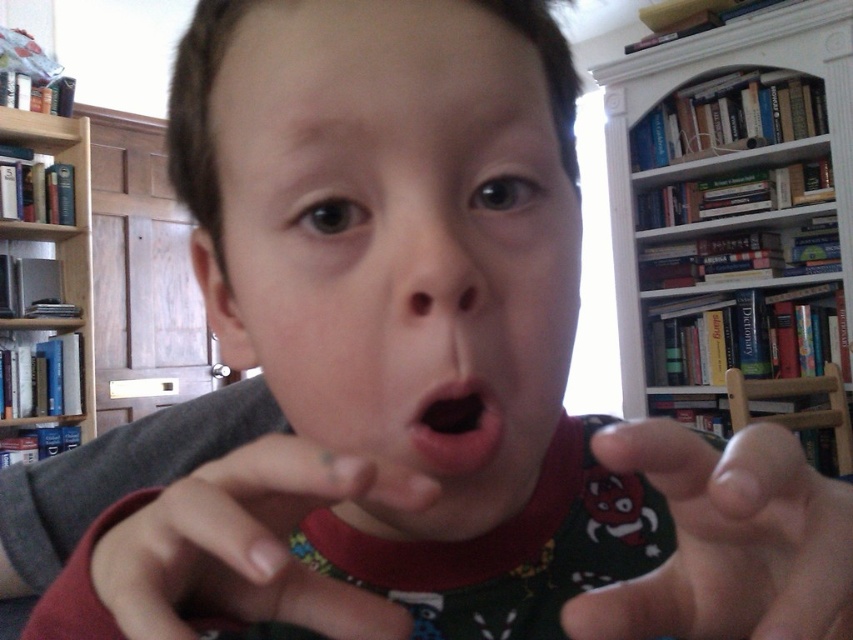
You are standing in a room with a wooden bookshelf and a child. You notice two points marked on the wall. The first point is at coordinates point (12, 458) and the second is at point (465, 378). Which point is closer to you?

Point (12, 458) is further to the viewer than point (465, 378), so the second point is closer to you.

You are a delivery person who needs to place a large package that is 6 feet long on the floor in front of the white wooden bookcase at upper right. Is there enough space between you and the bookcase to safely place the package without it touching the bookcase or any other objects?

The distance between the white wooden bookcase at upper right and the viewer is 6.15 feet. Since the package is 6 feet long, there is enough space to safely place it as the distance is slightly longer than the package.